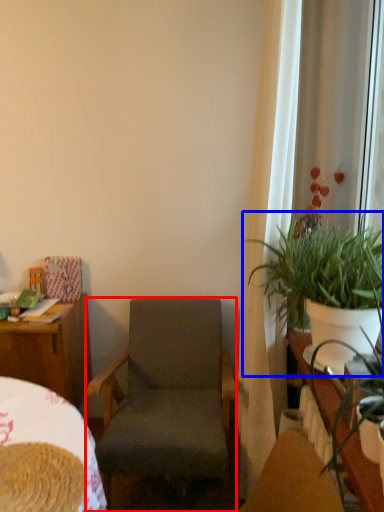
Question: Which object appears closest to the camera in this image, chair (highlighted by a red box) or houseplant (highlighted by a blue box)?

Choices:
 (A) chair
 (B) houseplant

Answer: (B)